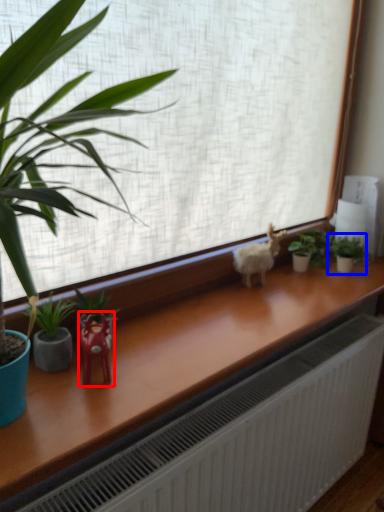
Question: Which point is further to the camera, miniature (highlighted by a red box) or houseplant (highlighted by a blue box)?

Choices:
 (A) miniature
 (B) houseplant

Answer: (B)